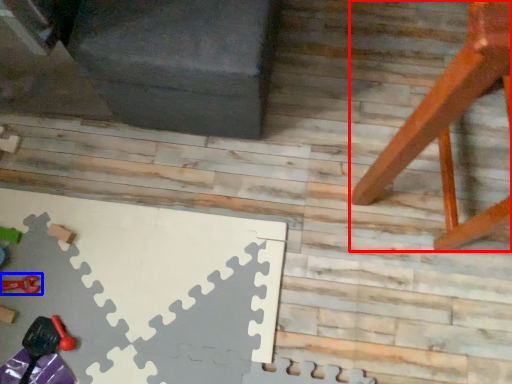
Question: Which object appears farthest to the camera in this image, furniture (highlighted by a red box) or toy (highlighted by a blue box)?

Choices:
 (A) furniture
 (B) toy

Answer: (B)